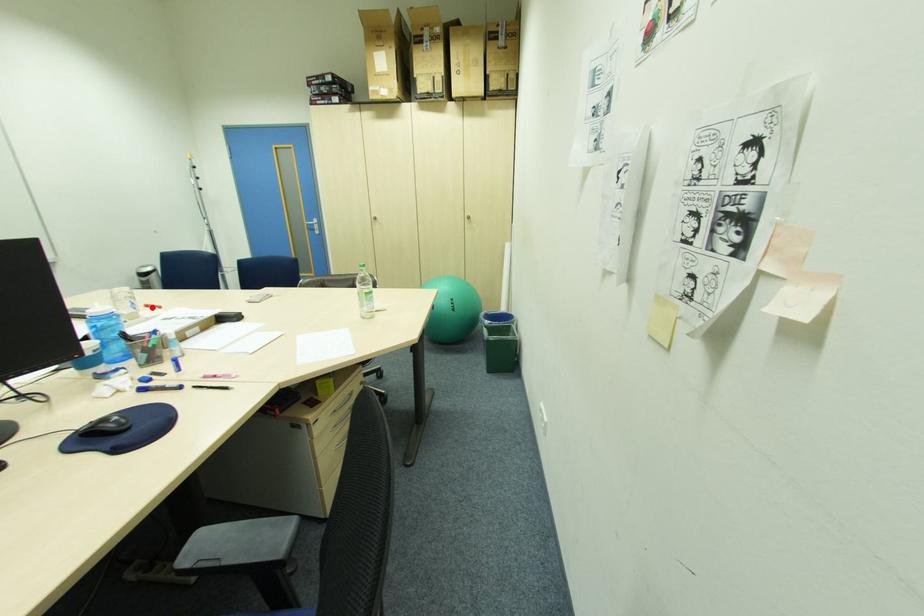
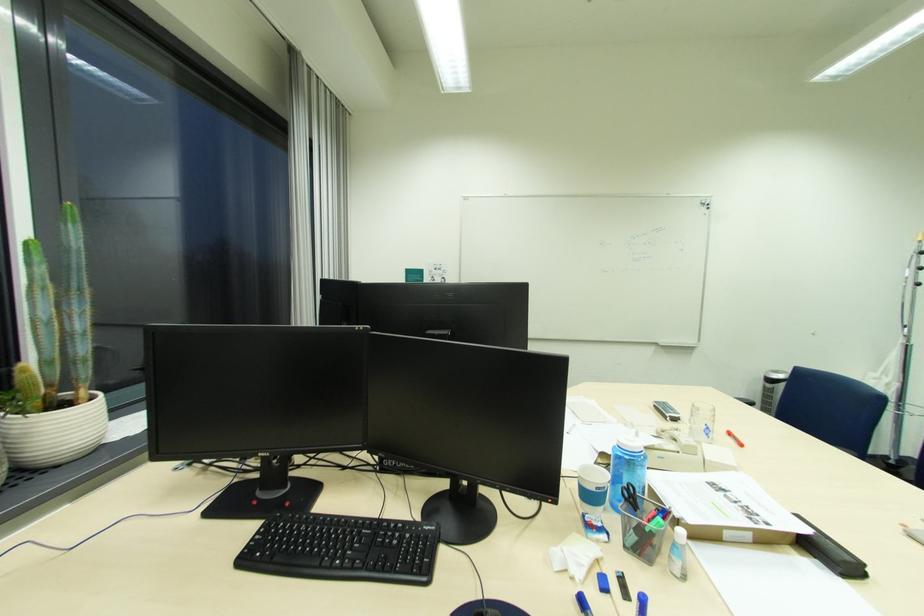
Where in the second image is the point corresponding to the highlighted location from the first image?

(736, 435)